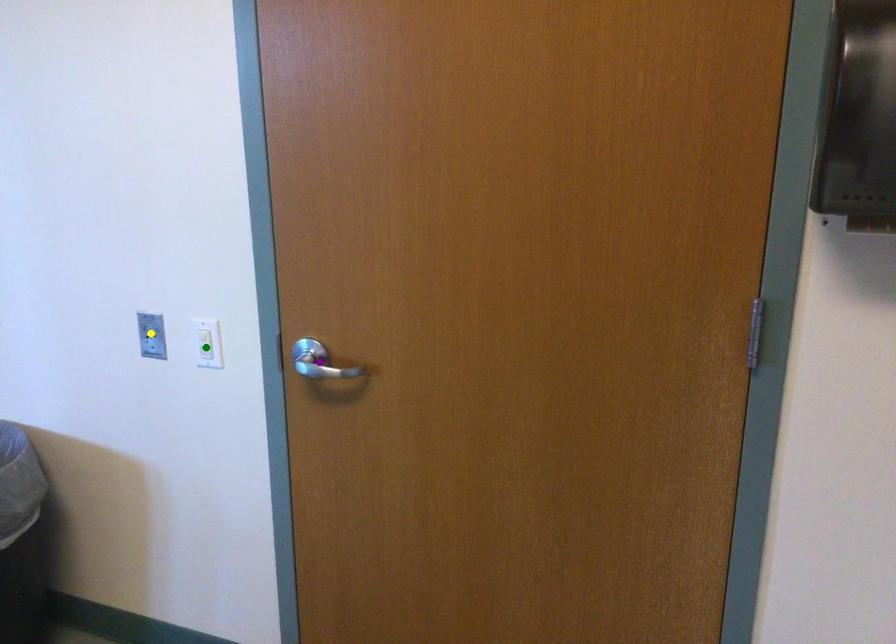
Order these from nearest to farthest:
green point
yellow point
purple point

purple point < green point < yellow point